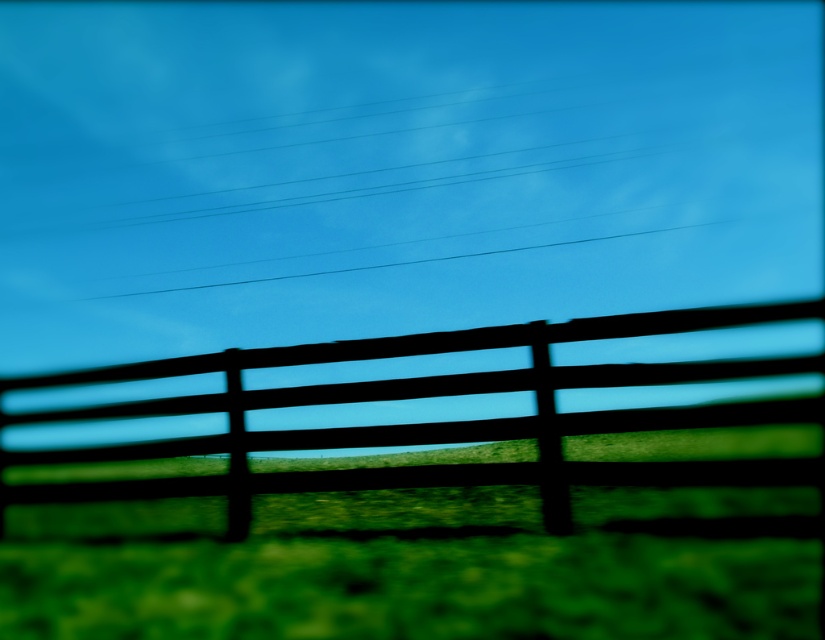
You are standing at the point marked by the wooden fence in the foreground. You want to walk to the green matte grass at center. In which direction should you move relative to the fence?

The green matte grass at center is located at point (420, 566), so you should move forward from the wooden fence in the foreground to reach it.

You are standing in the middle of the field looking at the green matte grass at center and the black wood fence at center. Which object is nearer to you?

The green matte grass at center is closer to the viewer than the black wood fence at center.

You are standing in the middle of the field looking at the black wood fence at center and the green matte grass at center. Which object is positioned to the left of the other?

The green matte grass at center is to the left of the black wood fence at center.